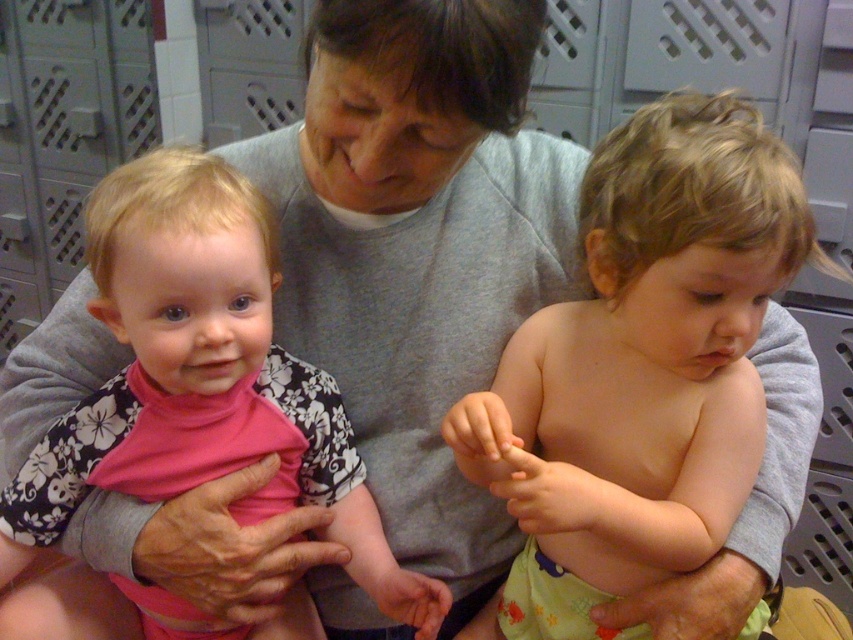
You are a photographer adjusting the lighting in this scene. You want to ensure that the smooth skin toddler at center is well lit. Where should you position your light source relative to the point at coordinates point (647, 352)?

The point at coordinates point (647, 352) corresponds to the smooth skin toddler at center, so positioning the light source directly in front of this point would ensure optimal lighting on the toddler.

Based on the photo, you are a photographer setting up a photo shoot in a locker room. You need to position the smooth skin toddler at center and the pink fabric toddler at left so that they are facing the camera. Based on their current positions, which toddler is closer to the camera?

The smooth skin toddler at center is closer to the camera than the pink fabric toddler at left because the smooth skin toddler at center is to the right of the pink fabric toddler at left.